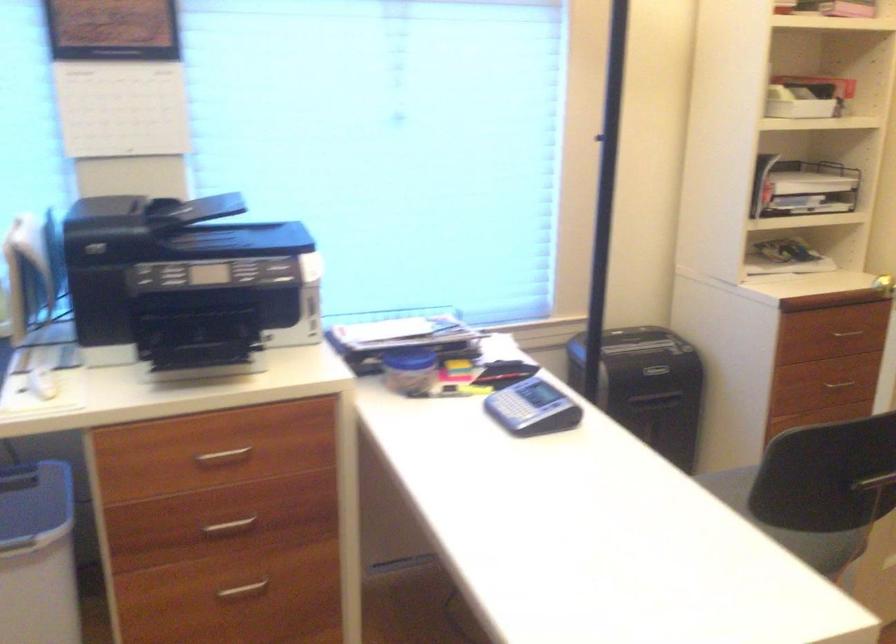
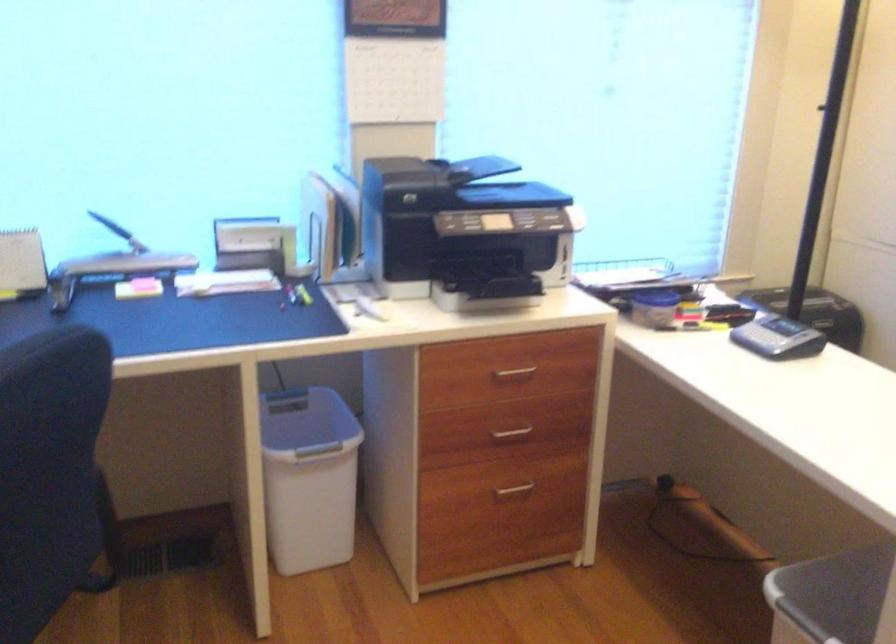
Where in the second image is the point corresponding to point (227, 456) from the first image?

(513, 374)